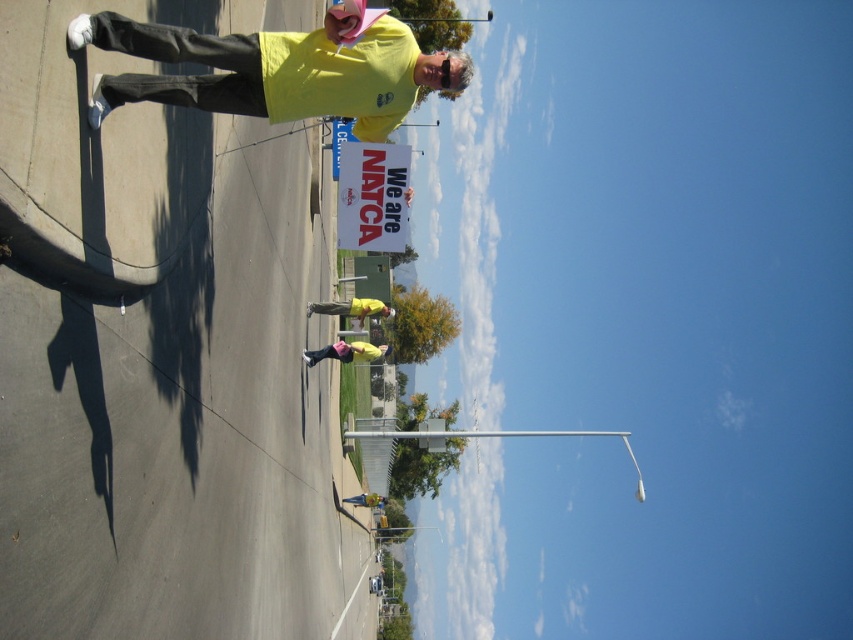
Question: Can you confirm if yellow matte shirt at center is wider than pink fabric at center?

Choices:
 (A) no
 (B) yes

Answer: (B)

Question: Is yellow matte shirt at center to the right of pink fabric at center from the viewer's perspective?

Choices:
 (A) no
 (B) yes

Answer: (A)

Question: Which point appears closest to the camera in this image?

Choices:
 (A) click(352, 307)
 (B) click(361, 504)
 (C) click(346, 348)

Answer: (A)

Question: Which of the following is the farthest from the observer?

Choices:
 (A) pink fabric at center
 (B) yellow matte shirt at center
 (C) yellow fabric shirt at center

Answer: (C)

Question: Is yellow matte shirt at center in front of yellow fabric shirt at center?

Choices:
 (A) yes
 (B) no

Answer: (A)

Question: Which of the following is the closest to the observer?

Choices:
 (A) yellow fabric shirt at center
 (B) pink fabric at center
 (C) yellow matte shirt at center

Answer: (B)